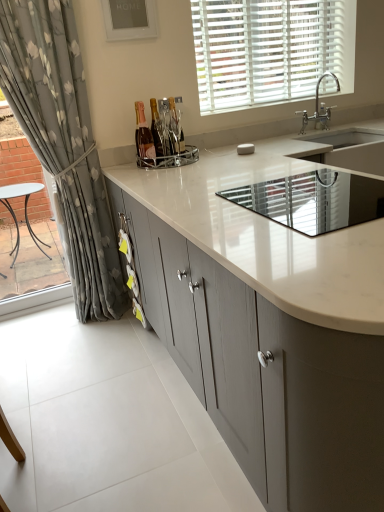
Question: Is the depth of silver metallic faucet at upper right less than that of chrome metallic wine rack at center, which ranks as the 1th appliance in left-to-right order?

Choices:
 (A) no
 (B) yes

Answer: (A)

Question: Is silver metallic faucet at upper right not within chrome metallic wine rack at center, which is the second appliance from bottom to top?

Choices:
 (A) yes
 (B) no

Answer: (A)

Question: Does silver metallic faucet at upper right have a larger size compared to chrome metallic wine rack at center, which is the second appliance in front-to-back order?

Choices:
 (A) no
 (B) yes

Answer: (B)

Question: Is silver metallic faucet at upper right positioned with its back to chrome metallic wine rack at center, the second appliance viewed from the right?

Choices:
 (A) no
 (B) yes

Answer: (A)

Question: From the image's perspective, is silver metallic faucet at upper right under chrome metallic wine rack at center, positioned as the first appliance in back-to-front order?

Choices:
 (A) yes
 (B) no

Answer: (B)

Question: Based on their sizes in the image, would you say white matte blinds at upper center is bigger or smaller than chrome metallic wine rack at center, which is the second appliance from bottom to top?

Choices:
 (A) small
 (B) big

Answer: (B)

Question: Is white matte blinds at upper center taller or shorter than chrome metallic wine rack at center, which is the second appliance in front-to-back order?

Choices:
 (A) short
 (B) tall

Answer: (B)

Question: Choose the correct answer: Is white matte blinds at upper center inside chrome metallic wine rack at center, the second appliance viewed from the right, or outside it?

Choices:
 (A) inside
 (B) outside

Answer: (B)

Question: Is white matte blinds at upper center in front of or behind chrome metallic wine rack at center, positioned as the first appliance in back-to-front order, in the image?

Choices:
 (A) front
 (B) behind

Answer: (B)

Question: Based on their positions, is white matte blinds at upper center located to the left or right of matte gray cabinets at center?

Choices:
 (A) left
 (B) right

Answer: (B)

Question: From a real-world perspective, is white matte blinds at upper center above or below matte gray cabinets at center?

Choices:
 (A) above
 (B) below

Answer: (A)

Question: From the image's perspective, is white matte blinds at upper center located above or below matte gray cabinets at center?

Choices:
 (A) below
 (B) above

Answer: (B)

Question: Is white matte blinds at upper center situated inside matte gray cabinets at center or outside?

Choices:
 (A) inside
 (B) outside

Answer: (B)

Question: From their relative heights in the image, would you say silver metallic faucet at upper right is taller or shorter than matte gray cabinets at center?

Choices:
 (A) tall
 (B) short

Answer: (B)

Question: From a real-world perspective, is silver metallic faucet at upper right physically located above or below matte gray cabinets at center?

Choices:
 (A) below
 (B) above

Answer: (B)